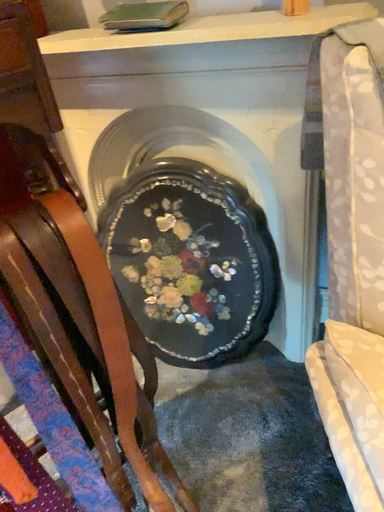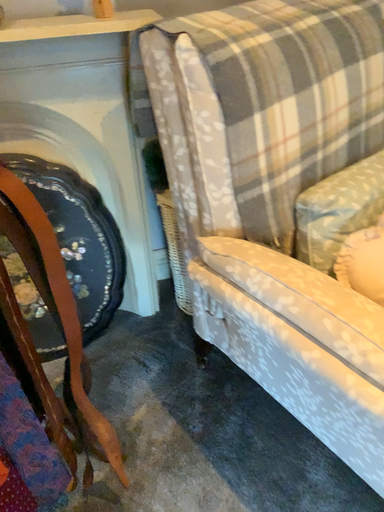
Question: How did the camera likely rotate when shooting the video?

Choices:
 (A) rotated left
 (B) rotated right

Answer: (B)